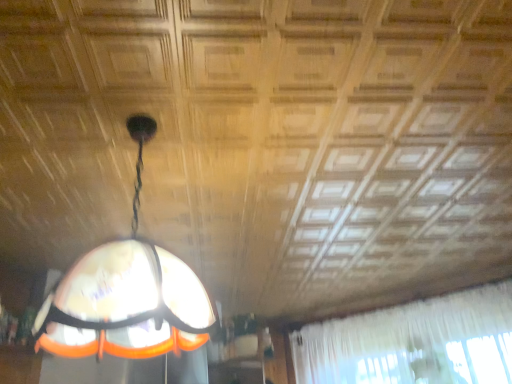
Question: Can you confirm if white sheer curtain at upper right is smaller than translucent glass lampshade at center?

Choices:
 (A) no
 (B) yes

Answer: (A)

Question: From a real-world perspective, is white sheer curtain at upper right physically below translucent glass lampshade at center?

Choices:
 (A) no
 (B) yes

Answer: (B)

Question: Is white sheer curtain at upper right to the left of translucent glass lampshade at center from the viewer's perspective?

Choices:
 (A) no
 (B) yes

Answer: (A)

Question: From a real-world perspective, is white sheer curtain at upper right on translucent glass lampshade at center?

Choices:
 (A) yes
 (B) no

Answer: (B)

Question: Does white sheer curtain at upper right have a lesser height compared to translucent glass lampshade at center?

Choices:
 (A) no
 (B) yes

Answer: (A)

Question: Are white sheer curtain at upper right and translucent glass lampshade at center located far from each other?

Choices:
 (A) yes
 (B) no

Answer: (A)

Question: Is translucent glass lampshade at center positioned with its back to white sheer curtain at upper right?

Choices:
 (A) yes
 (B) no

Answer: (B)

Question: From the image's perspective, is translucent glass lampshade at center under white sheer curtain at upper right?

Choices:
 (A) no
 (B) yes

Answer: (A)

Question: Is translucent glass lampshade at center thinner than white sheer curtain at upper right?

Choices:
 (A) no
 (B) yes

Answer: (A)

Question: Is translucent glass lampshade at center oriented towards white sheer curtain at upper right?

Choices:
 (A) yes
 (B) no

Answer: (A)

Question: Are translucent glass lampshade at center and white sheer curtain at upper right located far from each other?

Choices:
 (A) yes
 (B) no

Answer: (A)

Question: Is translucent glass lampshade at center closer to the viewer compared to white sheer curtain at upper right?

Choices:
 (A) yes
 (B) no

Answer: (A)

Question: Is white sheer curtain at upper right spatially inside translucent glass lampshade at center, or outside of it?

Choices:
 (A) inside
 (B) outside

Answer: (B)